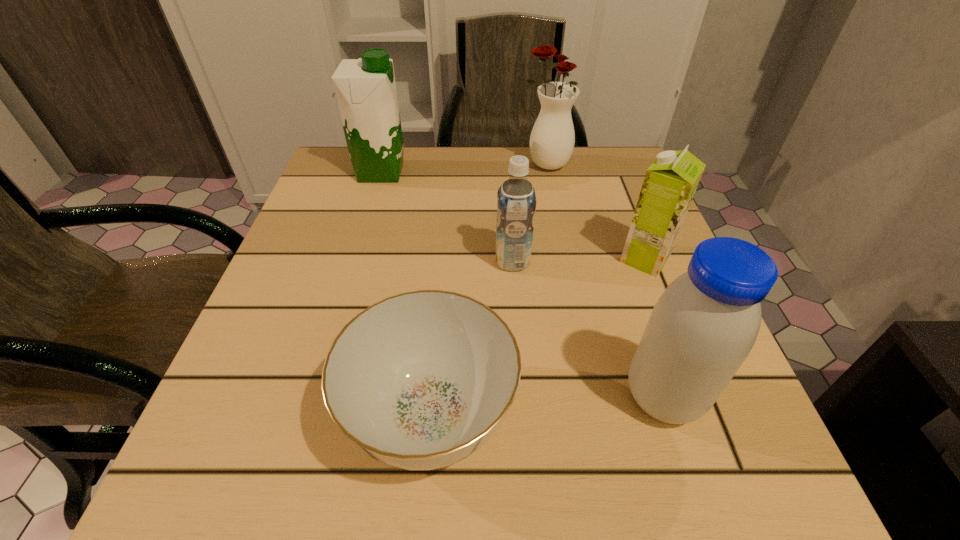
The height and width of the screenshot is (540, 960). I want to click on blank area at the left edge, so click(x=311, y=274).

You are a GUI agent. You are given a task and a screenshot of the screen. Output one action in this format:
    pyautogui.click(x=<x>, y=<y>)
    Task: Click on the vacant space at the right edge of the desktop
    
    Given the screenshot: What is the action you would take?
    pyautogui.click(x=616, y=314)

In the image, there is a desktop. In order to click on vacant space at the near left corner in this screenshot , I will do pos(237,462).

You are a GUI agent. You are given a task and a screenshot of the screen. Output one action in this format:
    pyautogui.click(x=<x>, y=<y>)
    Task: Click on the free space at the far right corner of the desktop
    The image size is (960, 540).
    Given the screenshot: What is the action you would take?
    pyautogui.click(x=573, y=159)

Find the location of a particular element. This screenshot has height=540, width=960. vacant space that is in between the vase and the leftmost soya milk is located at coordinates (463, 168).

Locate an element on the screen. The width and height of the screenshot is (960, 540). unoccupied position between the nearest soya milk and the farthest soya milk is located at coordinates (522, 285).

Choose which object is the fourth nearest neighbor to the third soya milk from right to left. Please provide its 2D coordinates. Your answer should be formatted as a tuple, i.e. [(x, y)], where the tuple contains the x and y coordinates of a point satisfying the conditions above.

[(552, 139)]

Locate an element on the screen. This screenshot has width=960, height=540. object that stands as the closest to the chinaware is located at coordinates (704, 325).

You are a GUI agent. You are given a task and a screenshot of the screen. Output one action in this format:
    pyautogui.click(x=<x>, y=<y>)
    Task: Click on the soya milk that is the third closest to the farthest soya milk
    The height and width of the screenshot is (540, 960).
    Given the screenshot: What is the action you would take?
    click(704, 325)

The image size is (960, 540). In order to click on soya milk that can be found as the fourth closest to the vase in this screenshot , I will do `click(704, 325)`.